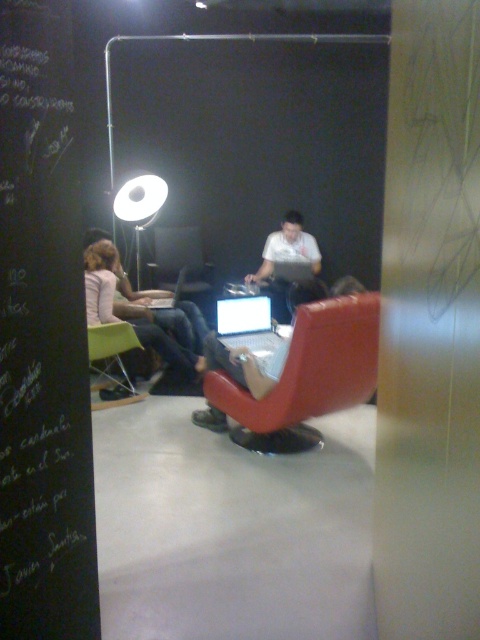
You are a visitor in this room and want to hang a poster on the wall. The poster is 2 meters tall. Do you think the black chalkboard at left has enough vertical space to accommodate the poster without overlapping the white glossy floor lamp at upper left?

The black chalkboard at left is much taller than the white glossy floor lamp at upper left, so there is enough vertical space to hang the 2 meter tall poster on the black chalkboard at left without overlapping the lamp.